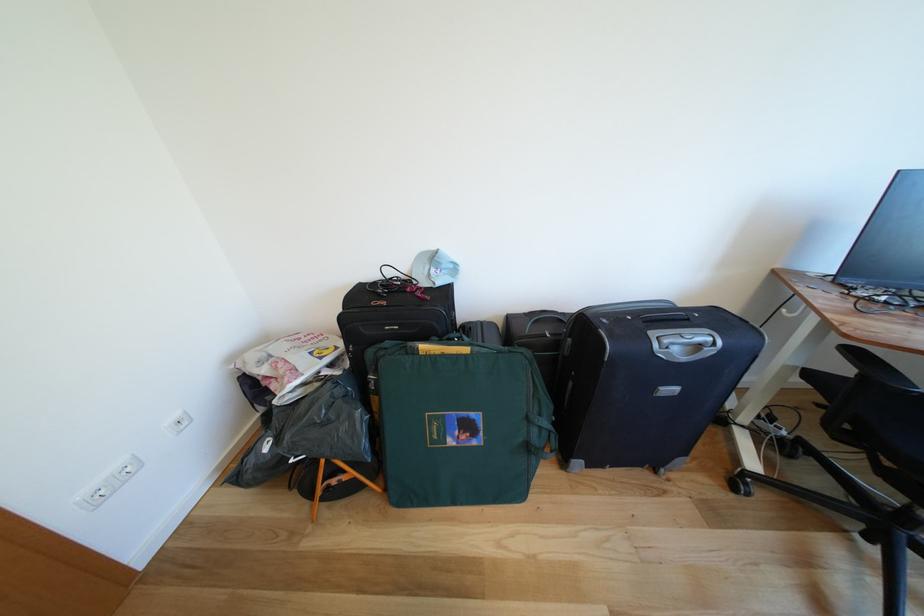
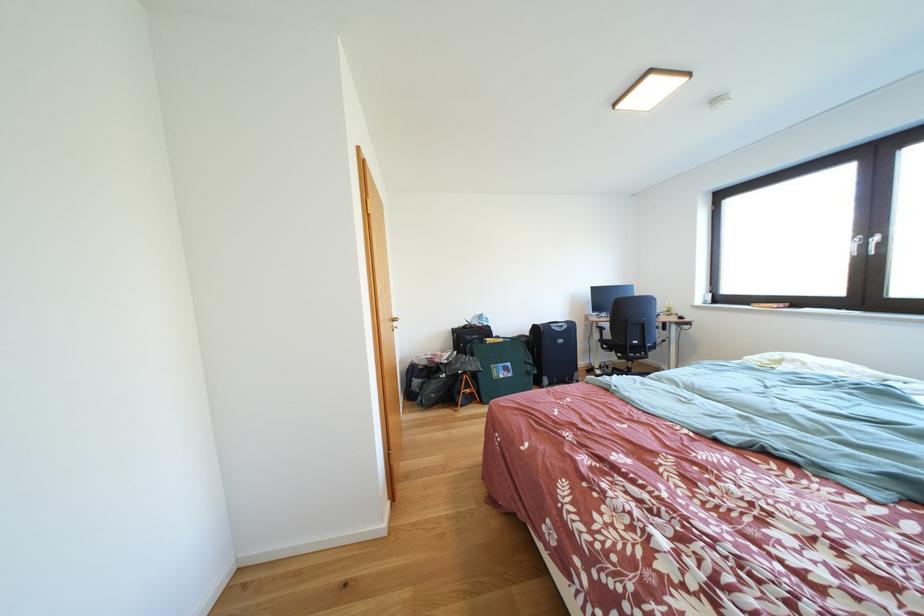
In a continuous first-person perspective shot, in which direction is the camera moving?

The cameraman walked toward left, backward.